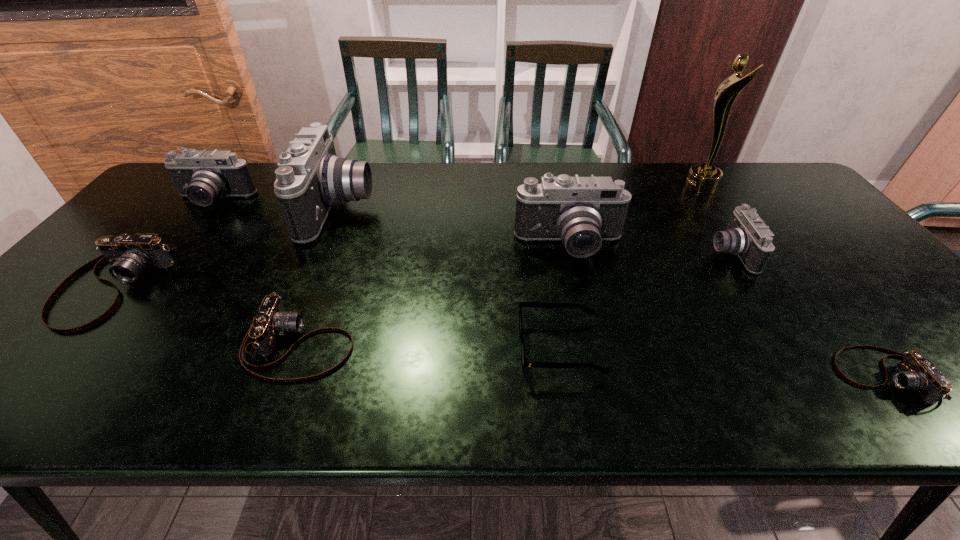
Identify the location of the tallest object. (702, 178).

Find the location of a particular element. the eighth shortest object is located at coordinates (311, 179).

The width and height of the screenshot is (960, 540). Identify the location of the biggest black camera. (311, 179).

This screenshot has width=960, height=540. In order to click on the second biggest black camera in this screenshot , I will do `click(581, 211)`.

Where is `the third camera from right to left`? The image size is (960, 540). the third camera from right to left is located at coordinates (581, 211).

Find the location of `the second smallest black camera`. the second smallest black camera is located at coordinates (203, 176).

The height and width of the screenshot is (540, 960). I want to click on the sixth shortest object, so click(x=203, y=176).

This screenshot has width=960, height=540. What are the coordinates of `the fifth shortest object` in the screenshot? It's located at (746, 235).

I want to click on the sixth camera from left to right, so click(x=746, y=235).

Locate an element on the screen. This screenshot has height=540, width=960. the fourth shortest object is located at coordinates (129, 255).